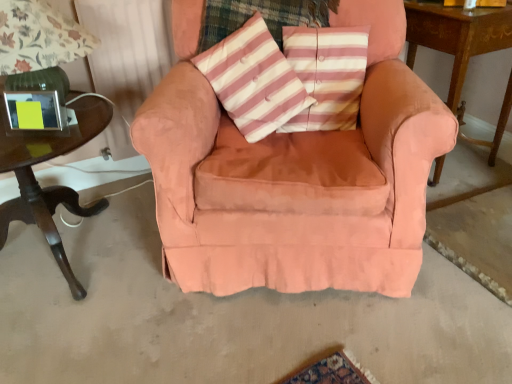
Identify the location of vacant area that is in front of suede-like peach armchair at center. This screenshot has width=512, height=384. (296, 337).